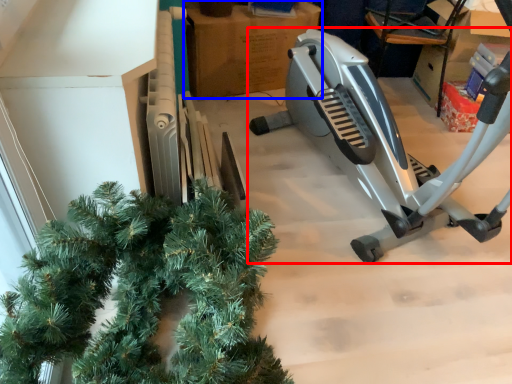
Question: Which object is closer to the camera taking this photo, stationary bicycle (highlighted by a red box) or cardboard box (highlighted by a blue box)?

Choices:
 (A) stationary bicycle
 (B) cardboard box

Answer: (A)